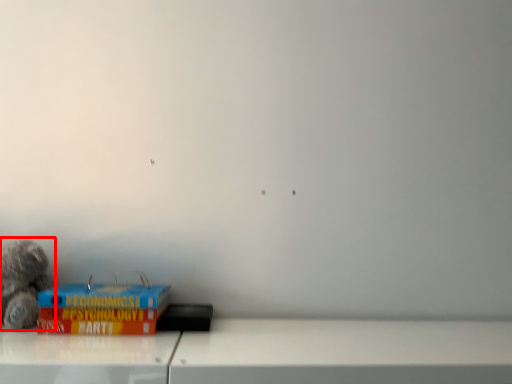
Question: From the image's perspective, considering the relative positions of toy (annotated by the red box) and paperback book in the image provided, where is toy (annotated by the red box) located with respect to the staircase?

Choices:
 (A) below
 (B) above

Answer: (B)